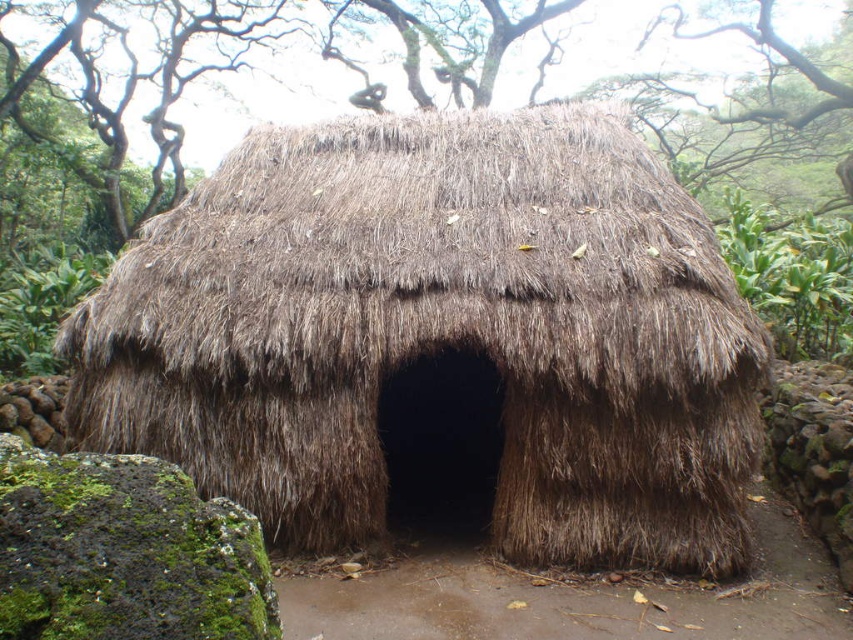
You are standing at the center of a large open field. You see a brown thatch hut at center in the distance. If you walk straight ahead, will you reach the brown thath hut at center?

Yes, since the brown thatch hut at center is located at point (438, 333), walking straight ahead from the center of the field will lead you directly to it.

You are standing in front of the brown thatch hut at center and want to place a small garden sign between it and the green leafy plant at upper right. Based on their positions, which object should the sign be closer to?

The brown thatch hut at center is closer to the viewer than the green leafy plant at upper right, so the sign should be placed closer to the green leafy plant at upper right to be centered between them.

You are a hiker who wants to take a photo of the brown thatch hut at center and the green leafy plant at upper right. Which object should you focus on first if you want to capture both in the same frame without moving the camera?

The brown thath hut at center is not as tall as the green leafy plant at upper right, so you should focus on the green leafy plant at upper right first to ensure it fits within the frame.